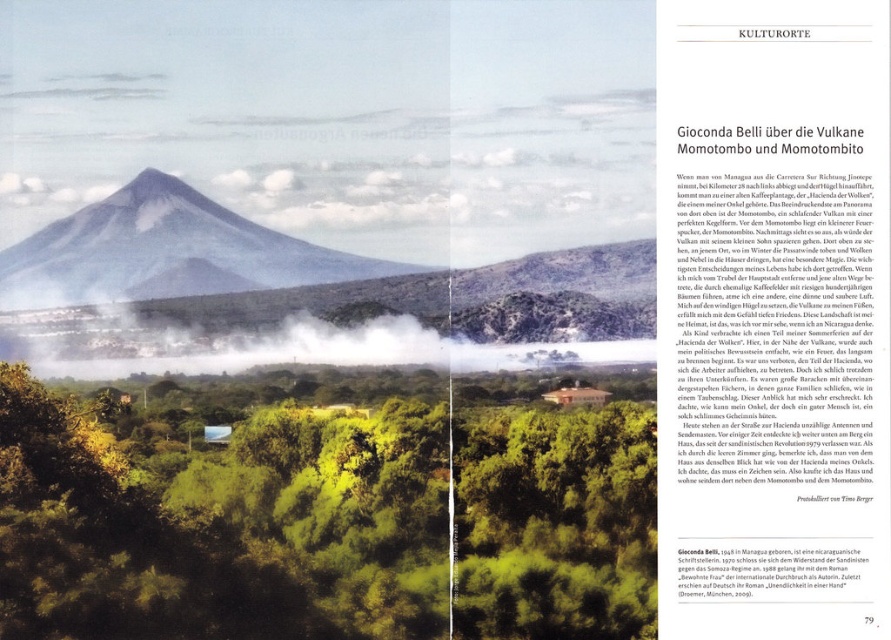
Can you confirm if green leafy tree at center is shorter than gray volcanic mountain at center?

No.

Does green leafy tree at center lie behind gray volcanic mountain at center?

That is False.

What do you see at coordinates (225, 508) in the screenshot? I see `green leafy tree at center` at bounding box center [225, 508].

Where is `green leafy tree at center`? The height and width of the screenshot is (640, 891). green leafy tree at center is located at coordinates (225, 508).

Does green leafy tree at center appear on the right side of black paper at lower center?

Incorrect, green leafy tree at center is not on the right side of black paper at lower center.

Is point (83, 612) closer to viewer compared to point (766, 548)?

Yes, it is.

Is point (84, 614) positioned before point (759, 586)?

Yes.

The height and width of the screenshot is (640, 891). Identify the location of green leafy tree at center. (225, 508).

Who is taller, gray volcanic mountain at center or black paper at lower center?

gray volcanic mountain at center

Between point (219, 272) and point (695, 595), which one is positioned in front?

Point (219, 272) is in front.

Find the location of `gray volcanic mountain at center`. gray volcanic mountain at center is located at coordinates [166, 252].